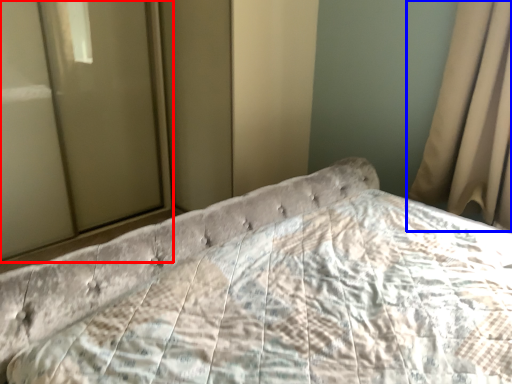
Question: Which point is closer to the camera, glass door (highlighted by a red box) or curtain (highlighted by a blue box)?

Choices:
 (A) glass door
 (B) curtain

Answer: (B)